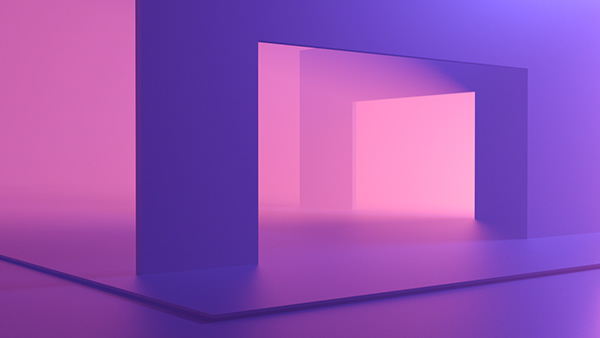
I want to click on space under arches, so click(382, 211).